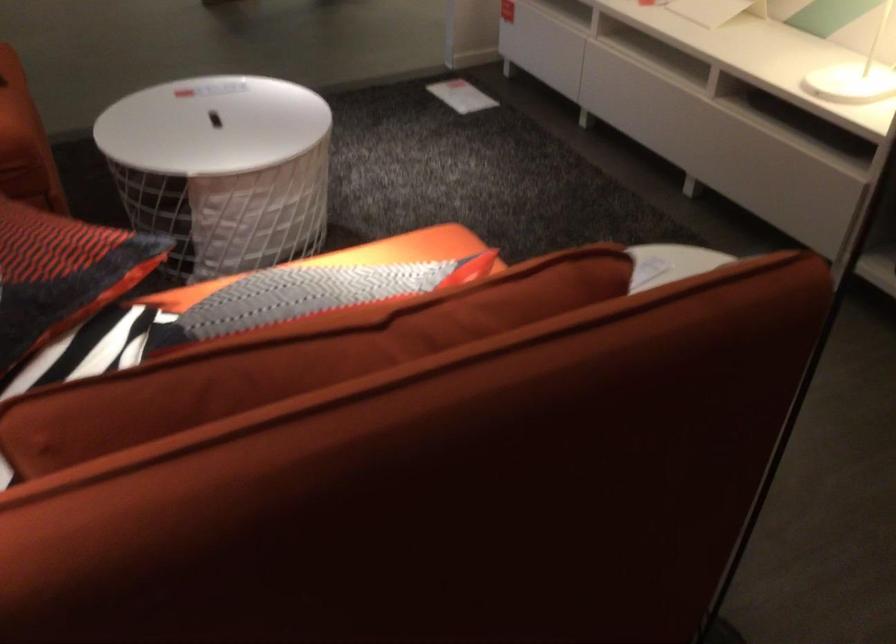
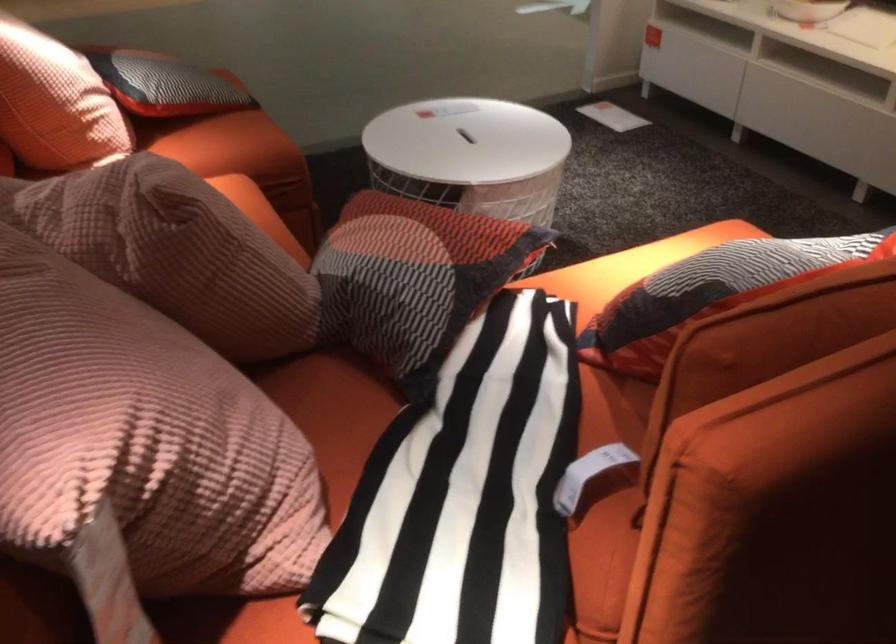
Question: The images are taken continuously from a first-person perspective. In which direction is your viewpoint rotating?

Choices:
 (A) Left
 (B) Right
 (C) Up
 (D) Down

Answer: (C)